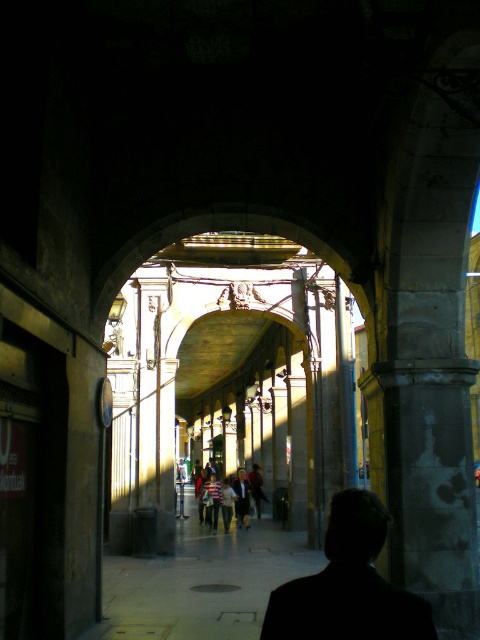
You are a fashion designer observing two people in the arched passageway. You notice a black matte suit at center and a striped fabric shirt at center. Which of these two items has a narrower width?

The black matte suit at center has a narrower width than the striped fabric shirt at center.